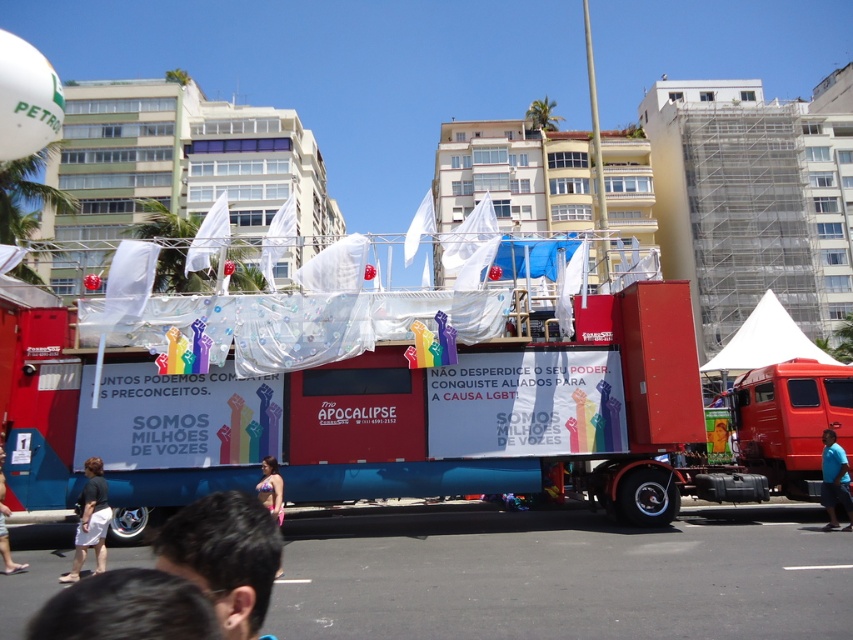
You are standing at the point with coordinates (x=279, y=493) and want to move to the float. The float is located at point (x=103, y=560). Is the float in front of you or behind you?

The float at point (x=103, y=560) is in front of you because it is in front of point (x=279, y=493) where you are standing.